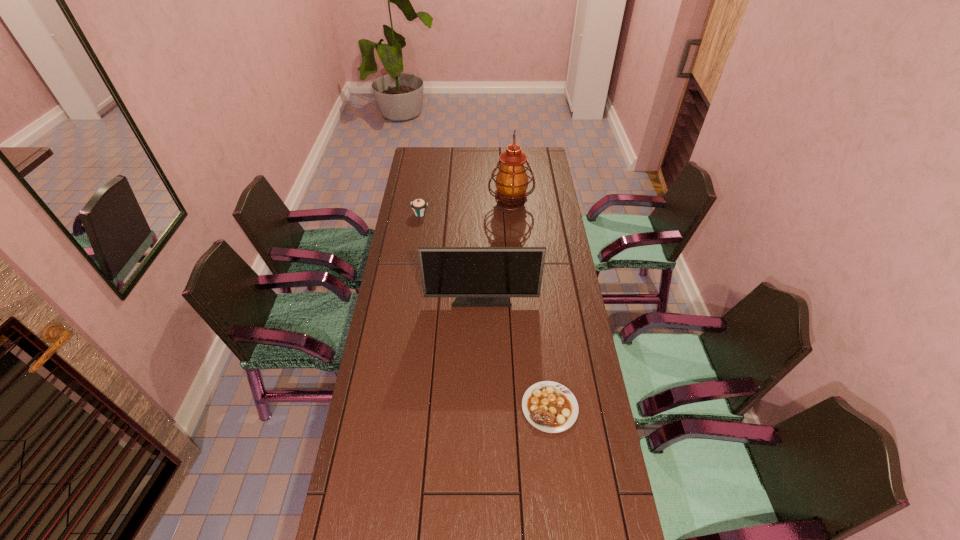
The width and height of the screenshot is (960, 540). In order to click on the tallest object in this screenshot , I will do `click(511, 182)`.

Locate an element on the screen. This screenshot has width=960, height=540. the second tallest object is located at coordinates (478, 276).

Identify the location of monitor. (478, 276).

Identify the location of cupcake. (419, 206).

Locate an element on the screen. Image resolution: width=960 pixels, height=540 pixels. the leftmost object is located at coordinates (419, 206).

This screenshot has width=960, height=540. In order to click on the nearest object in this screenshot , I will do `click(551, 407)`.

Identify the location of the shortest object. This screenshot has width=960, height=540. (551, 407).

The width and height of the screenshot is (960, 540). Find the location of `vacant position located on the back of the tallest object`. vacant position located on the back of the tallest object is located at coordinates (507, 157).

Where is `vacant space located 0.310m on the screen side of the monitor`? vacant space located 0.310m on the screen side of the monitor is located at coordinates (482, 378).

Where is `vacant space situated on the back of the leftmost object`? The height and width of the screenshot is (540, 960). vacant space situated on the back of the leftmost object is located at coordinates (423, 190).